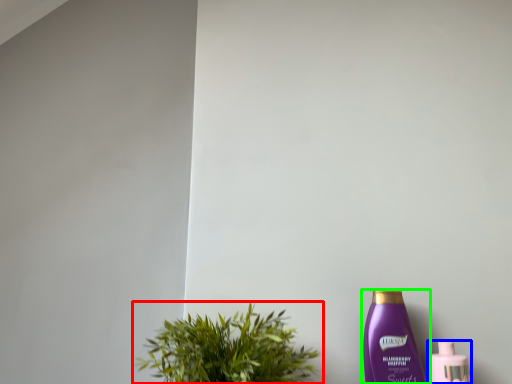
Question: Based on their relative distances, which object is farther from houseplant (highlighted by a red box)? Choose from bottle (highlighted by a blue box) and bottle (highlighted by a green box).

Choices:
 (A) bottle
 (B) bottle

Answer: (A)